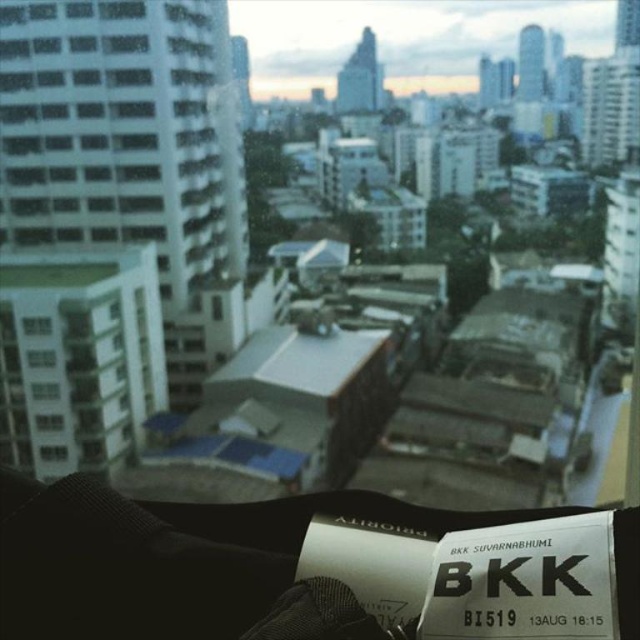
Question: Does transparent plastic window at upper left have a greater width compared to transparent plastic window at lower left?

Choices:
 (A) no
 (B) yes

Answer: (B)

Question: Is transparent plastic window at upper left bigger than transparent plastic window at lower left?

Choices:
 (A) no
 (B) yes

Answer: (B)

Question: Which point is farther to the camera?

Choices:
 (A) (29, 316)
 (B) (54, 456)

Answer: (B)

Question: From the image, what is the correct spatial relationship of transparent plastic window at upper left in relation to transparent plastic window at lower left?

Choices:
 (A) right
 (B) left

Answer: (B)